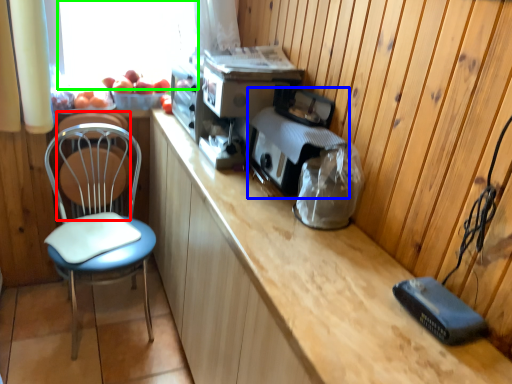
Question: Which object is positioned farthest from swivel chair (highlighted by a red box)? Select from appliance (highlighted by a blue box) and window screen (highlighted by a green box).

Choices:
 (A) appliance
 (B) window screen

Answer: (A)